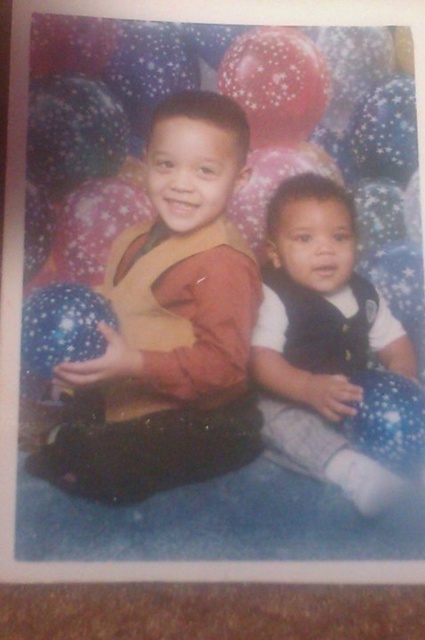
Based on the photo, which is more to the right, matte yellow vest at center or white soft vest at center?

Positioned to the right is white soft vest at center.

Does matte yellow vest at center have a greater height compared to white soft vest at center?

Yes.

The height and width of the screenshot is (640, 425). In order to click on matte yellow vest at center in this screenshot , I will do `click(163, 324)`.